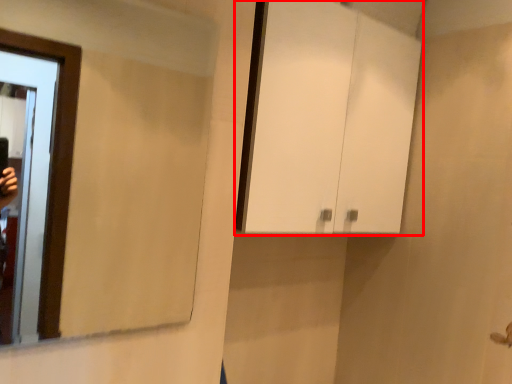
Question: In this image, where is cabinetry (annotated by the red box) located relative to mirror?

Choices:
 (A) left
 (B) right

Answer: (B)